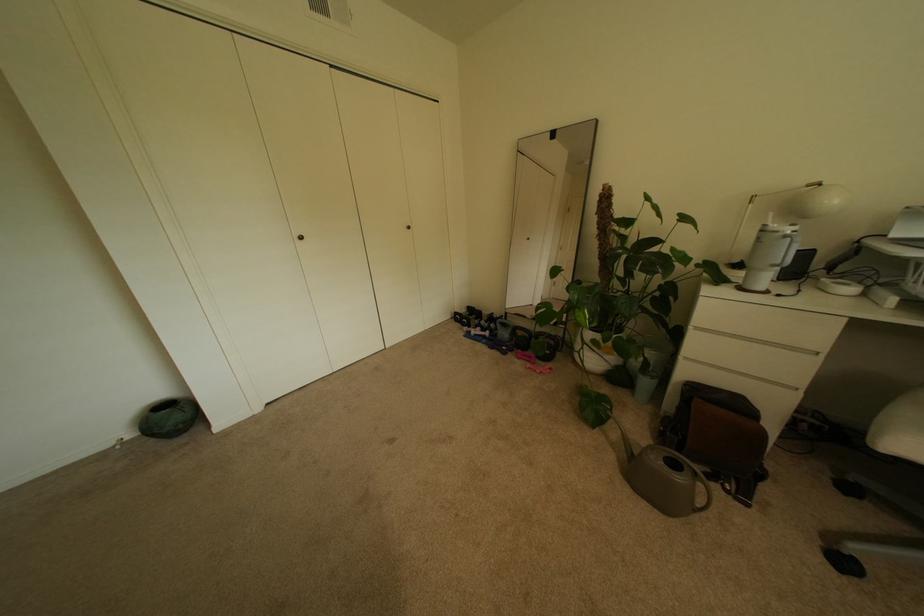
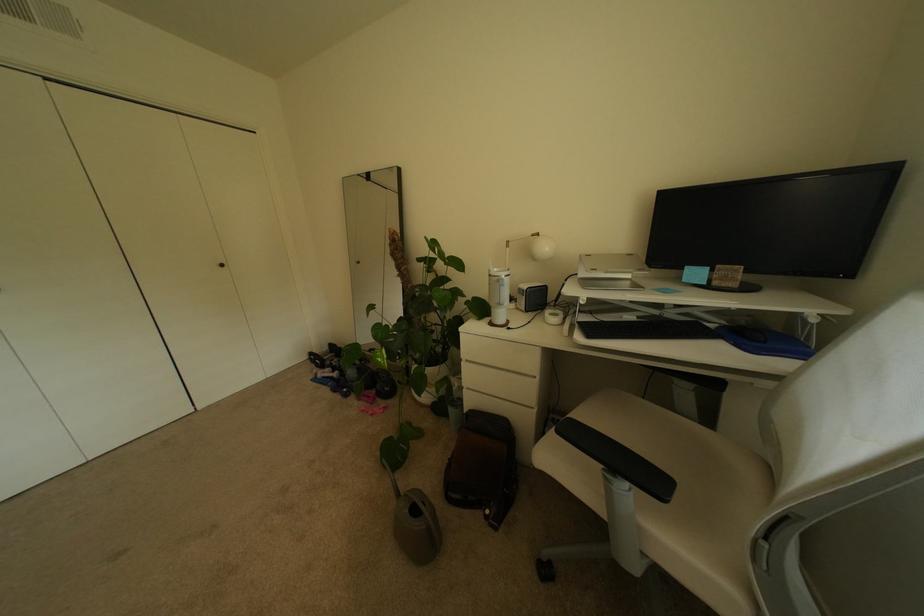
Find the pixel in the second image that matches [749,291] in the first image.

(500, 325)